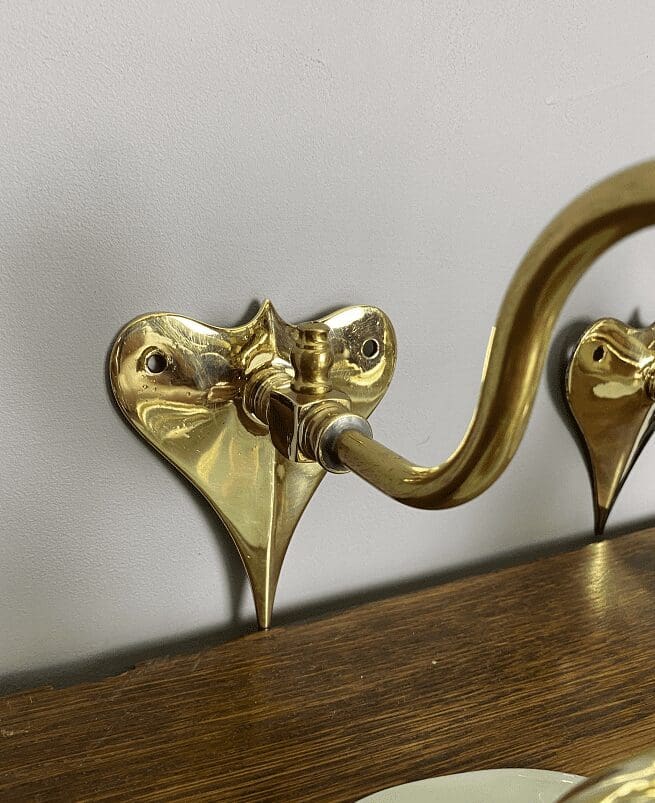
The height and width of the screenshot is (803, 655). I want to click on wall connectors, so click(262, 528).